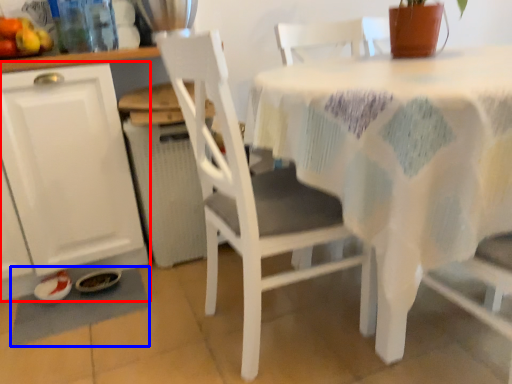
Question: Which object appears closest to the camera in this image, cabinetry (highlighted by a red box) or place mat (highlighted by a blue box)?

Choices:
 (A) cabinetry
 (B) place mat

Answer: (A)